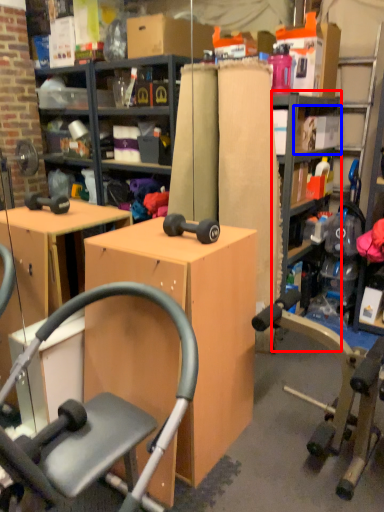
Question: Which of the following is the farthest to the observer, bookshelf (highlighted by a red box) or shelf (highlighted by a blue box)?

Choices:
 (A) bookshelf
 (B) shelf

Answer: (B)